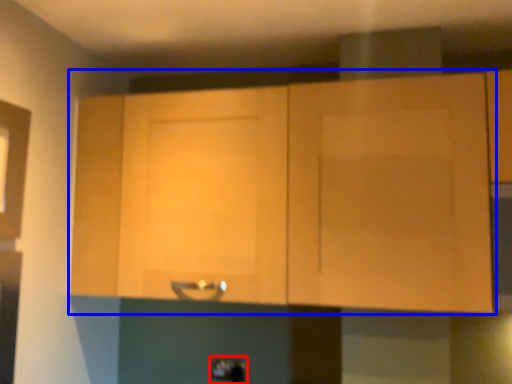
Question: Which of the following is the farthest to the observer, door handle (highlighted by a red box) or cabinetry (highlighted by a blue box)?

Choices:
 (A) door handle
 (B) cabinetry

Answer: (A)